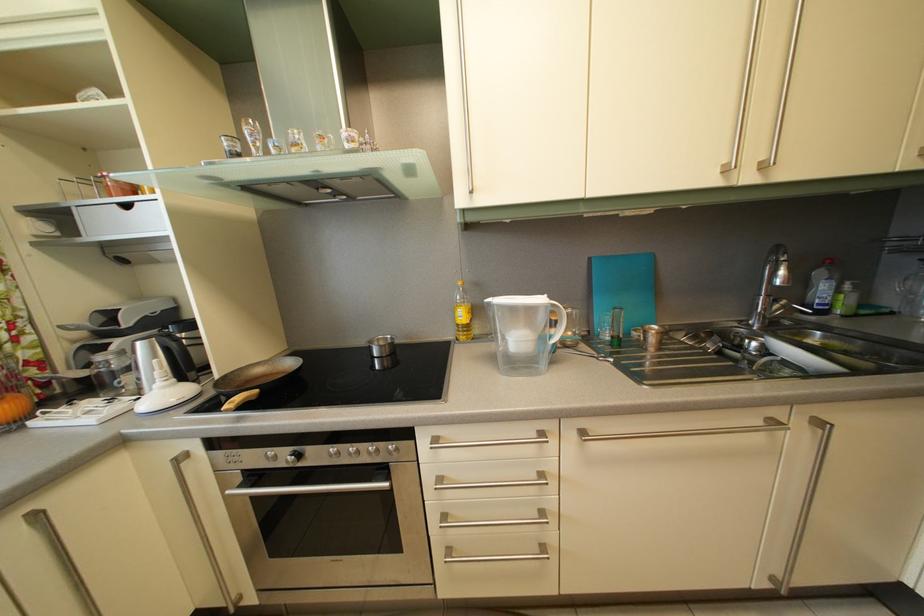
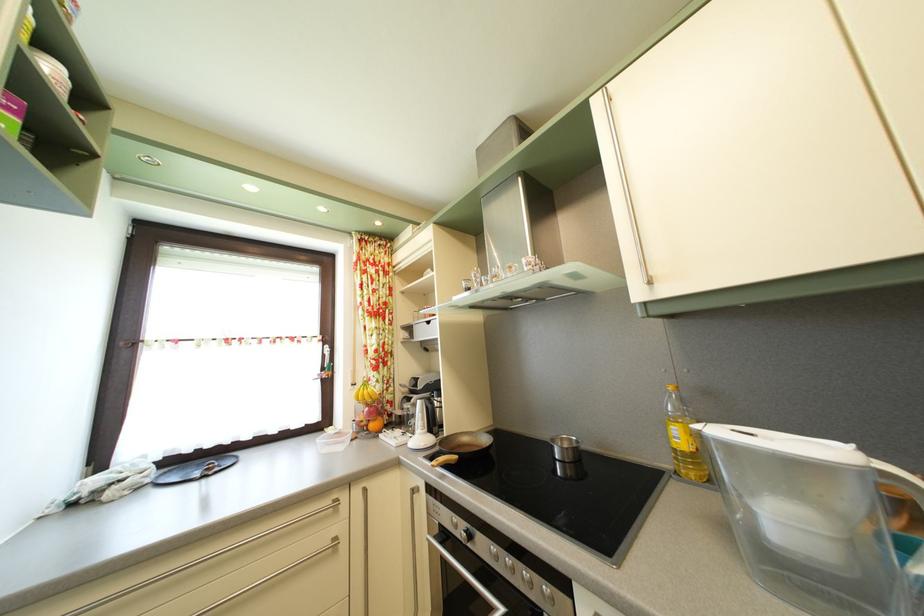
The point at (323, 463) is marked in the first image. Where is the corresponding point in the second image?

(490, 553)